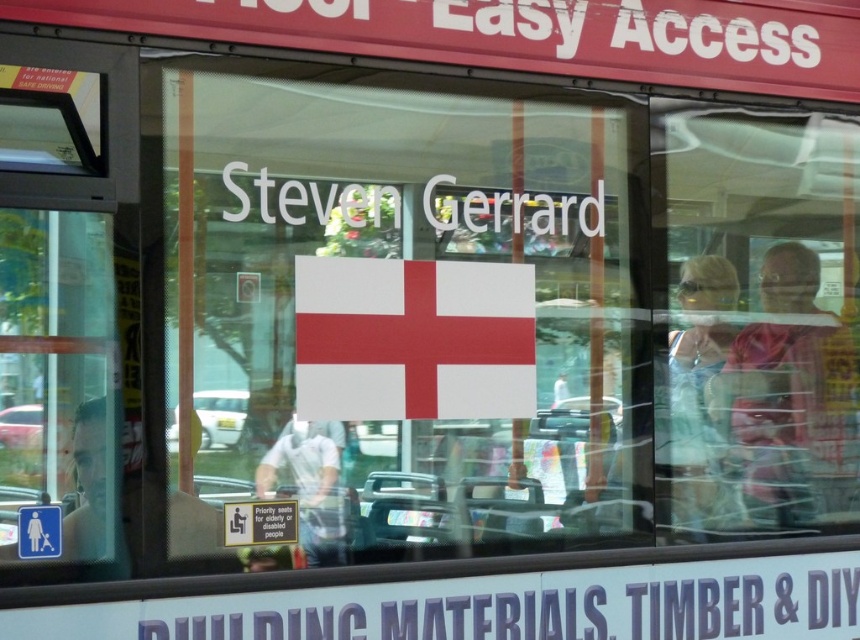
Who is higher up, white paper at center or white matte flag at center?

white paper at center is above.

Does white paper at center come behind white matte flag at center?

That is False.

Identify the location of white paper at center. This screenshot has width=860, height=640. (409, 307).

Locate an element on the screen. The width and height of the screenshot is (860, 640). white paper at center is located at coordinates (409, 307).